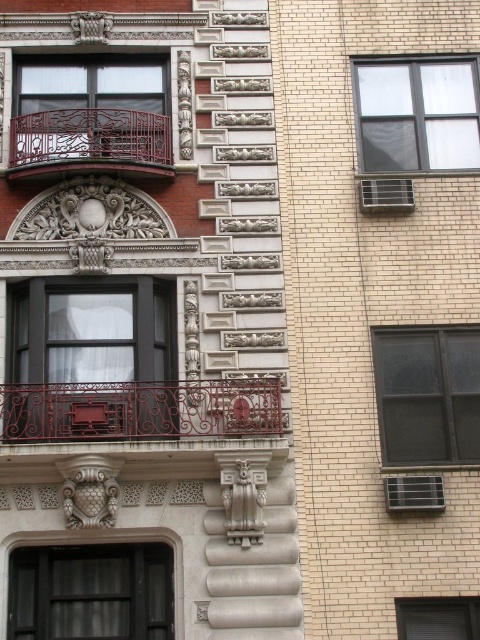
You are standing in front of the building and want to determine which structure is shorter between the rusty metal railing at center and the matte black balcony at left. Can you identify the shorter one?

The rusty metal railing at center has a lesser height compared to the matte black balcony at left, so the rusty metal railing at center is shorter.

You are standing in front of the building and see two points marked on its facade. The first point is at coordinates point (41, 108) and the second is at point (87, 160). Which point is closer to you?

Point (41, 108) is closer to you because it is further to the viewer than point (87, 160).